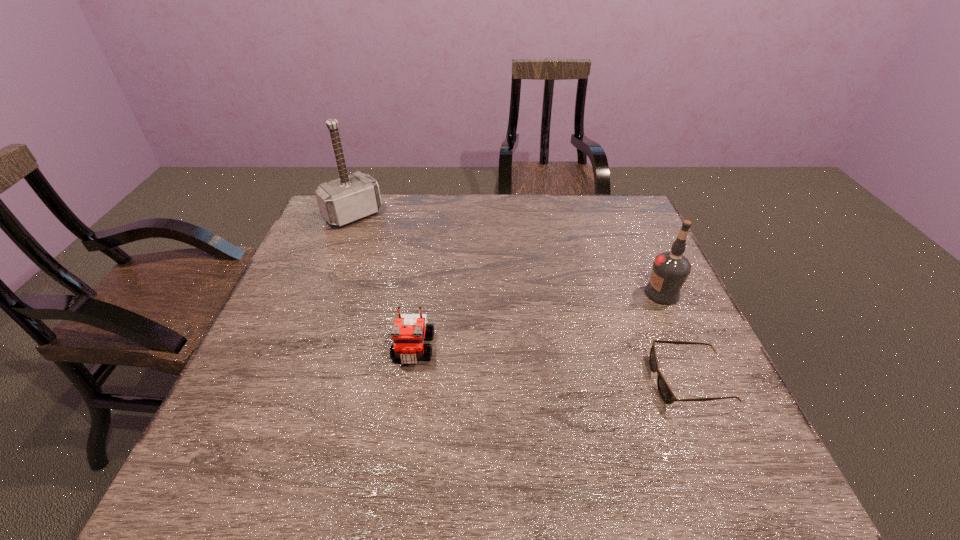
This screenshot has height=540, width=960. In order to click on vacant point located between the second farthest object and the Lego in this screenshot , I will do point(538,321).

Identify the location of vacant space that's between the farthest object and the third shortest object. Image resolution: width=960 pixels, height=540 pixels. (508, 254).

The width and height of the screenshot is (960, 540). Identify the location of blank region between the shortest object and the tallest object. (521, 298).

Identify the location of unoccupied position between the third tallest object and the leftmost object. This screenshot has height=540, width=960. (383, 282).

Identify the location of vacant space that is in between the tallest object and the shortest object. coord(521,298).

You are a GUI agent. You are given a task and a screenshot of the screen. Output one action in this format:
    pyautogui.click(x=<x>, y=<y>)
    Task: Click on the unoccupied position between the Lego and the vodka
    The width and height of the screenshot is (960, 540).
    Given the screenshot: What is the action you would take?
    pyautogui.click(x=538, y=321)

I want to click on vacant space in between the shortest object and the vodka, so click(676, 338).

Locate an element on the screen. The image size is (960, 540). vacant space in between the vodka and the shortest object is located at coordinates (676, 338).

This screenshot has height=540, width=960. I want to click on free space between the third object from right to left and the shortest object, so click(552, 365).

Image resolution: width=960 pixels, height=540 pixels. Find the location of `free spot between the second object from left to right and the hammer`. free spot between the second object from left to right and the hammer is located at coordinates (383, 282).